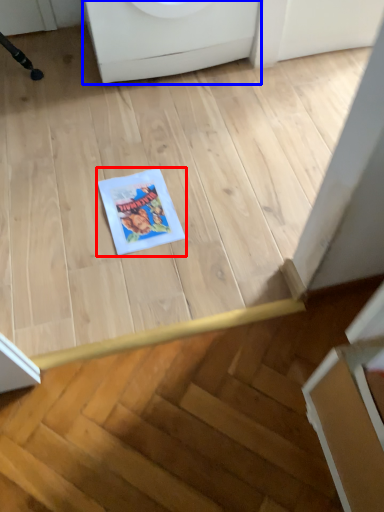
Question: Which object is further to the camera taking this photo, comic book (highlighted by a red box) or washing machine (highlighted by a blue box)?

Choices:
 (A) comic book
 (B) washing machine

Answer: (B)